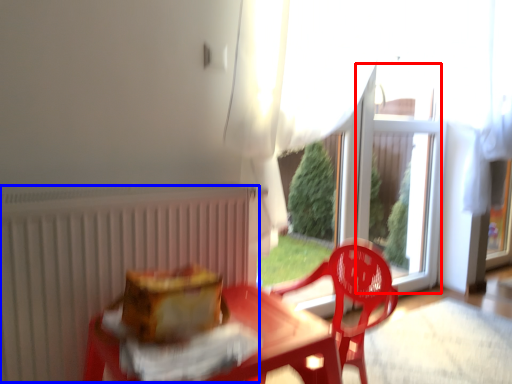
Question: Which point is closer to the camera, window screen (highlighted by a red box) or radiator (highlighted by a blue box)?

Choices:
 (A) window screen
 (B) radiator

Answer: (B)